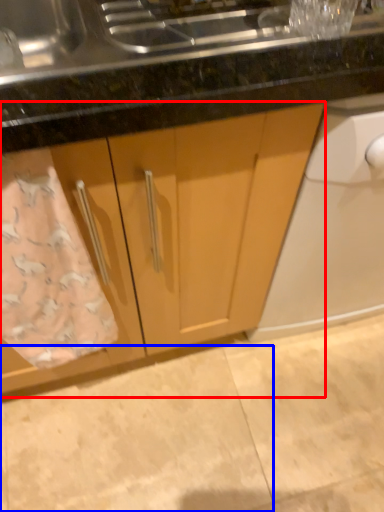
Question: Which of the following is the closest to the observer, cabinetry (highlighted by a red box) or granite (highlighted by a blue box)?

Choices:
 (A) cabinetry
 (B) granite

Answer: (A)